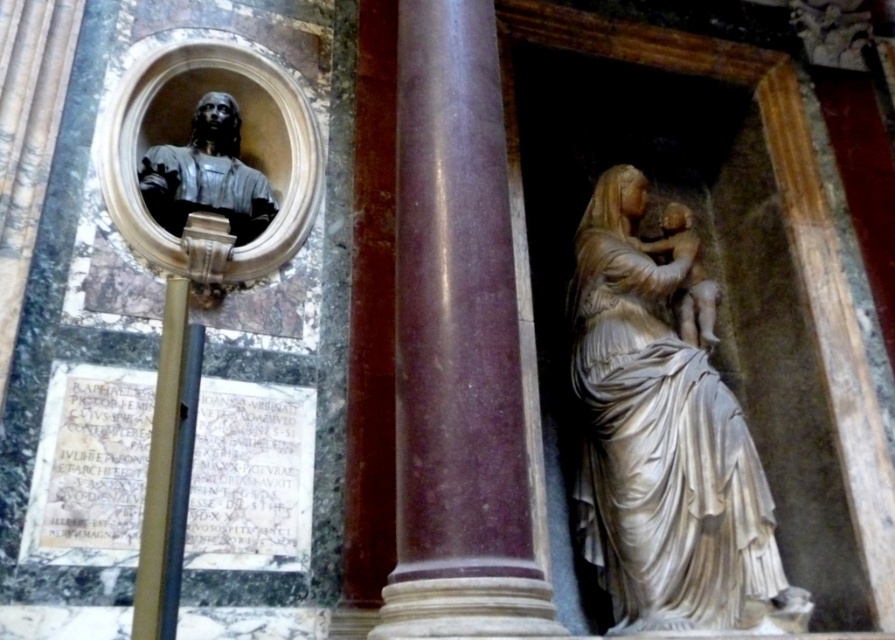
Question: Where is white marble statue at center located in relation to white marble statue at right in the image?

Choices:
 (A) left
 (B) right

Answer: (A)

Question: Estimate the real-world distances between objects in this image. Which object is farther from the purple marble column at center?

Choices:
 (A) white marble statue at center
 (B) white marble statue at right
 (C) polished bronze bust at upper left

Answer: (B)

Question: Among these objects, which one is farthest from the camera?

Choices:
 (A) polished bronze bust at upper left
 (B) white marble statue at center
 (C) white marble statue at right

Answer: (C)

Question: Among these points, which one is farthest from the camera?

Choices:
 (A) (175, 189)
 (B) (452, 312)
 (C) (668, 458)
 (D) (695, 326)

Answer: (D)

Question: Does polished bronze bust at upper left appear on the right side of white marble statue at right?

Choices:
 (A) yes
 (B) no

Answer: (B)

Question: Does purple marble column at center have a smaller size compared to white marble statue at right?

Choices:
 (A) no
 (B) yes

Answer: (A)